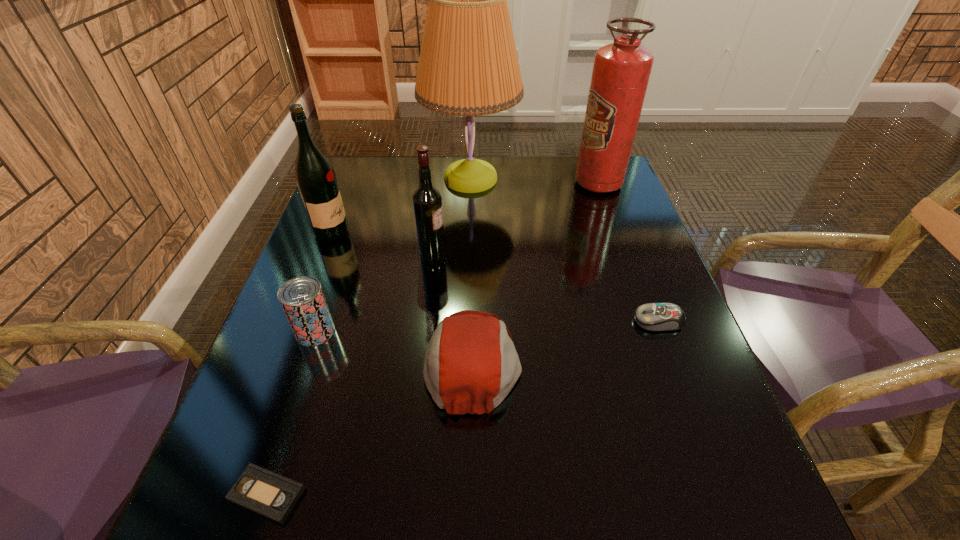
This screenshot has width=960, height=540. I want to click on lamp, so click(x=468, y=66).

Find the location of a particular element. This screenshot has height=540, width=960. fire extinguisher is located at coordinates (x=621, y=70).

Locate an element on the screen. This screenshot has height=540, width=960. liquor is located at coordinates (316, 180).

You are a GUI agent. You are given a task and a screenshot of the screen. Output one action in this format:
    pyautogui.click(x=<x>, y=<y>)
    Task: Click on the fourth farthest object
    Image resolution: width=960 pixels, height=540 pixels.
    Given the screenshot: What is the action you would take?
    pyautogui.click(x=427, y=200)

Image resolution: width=960 pixels, height=540 pixels. In order to click on the fourth tallest object in this screenshot , I will do (427, 200).

Image resolution: width=960 pixels, height=540 pixels. In order to click on beer can in this screenshot , I will do [x=302, y=299].

This screenshot has height=540, width=960. I want to click on cap, so click(x=471, y=364).

Where is `the second shortest object`? The image size is (960, 540). the second shortest object is located at coordinates (657, 317).

Image resolution: width=960 pixels, height=540 pixels. Identify the location of the nearest object. (273, 496).

Where is `the shortest object`? The height and width of the screenshot is (540, 960). the shortest object is located at coordinates (273, 496).